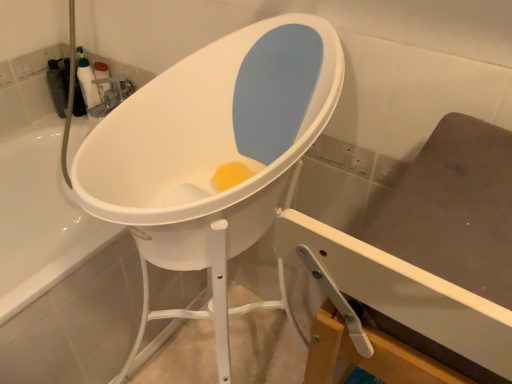
Identify the location of matte silver faucet at upper left. This screenshot has width=512, height=384. (112, 95).

What do you see at coordinates (112, 95) in the screenshot? I see `matte silver faucet at upper left` at bounding box center [112, 95].

Where is `matte silver faucet at upper left`? Image resolution: width=512 pixels, height=384 pixels. matte silver faucet at upper left is located at coordinates (112, 95).